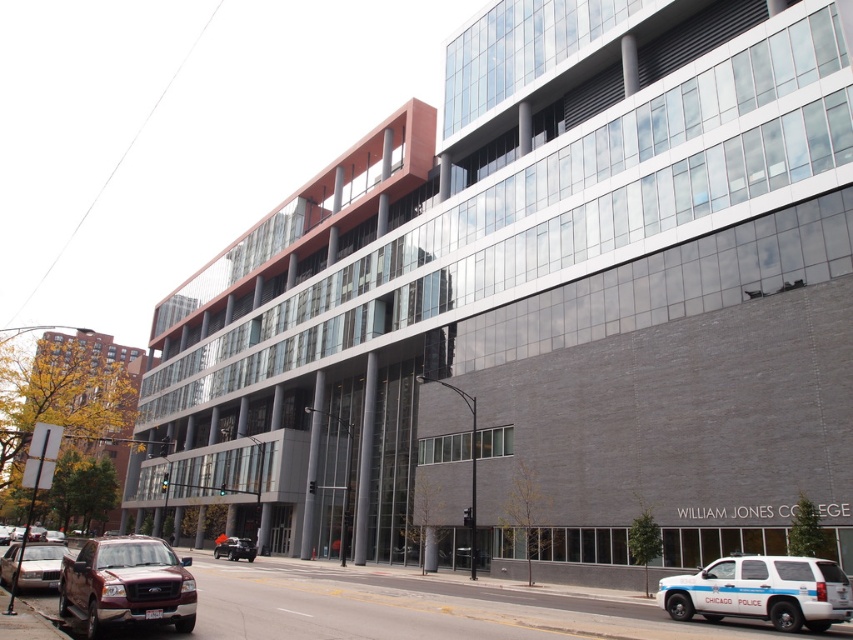
Question: Which point appears farthest from the camera in this image?

Choices:
 (A) (33, 561)
 (B) (251, 548)

Answer: (B)

Question: Can you confirm if white matte suv at lower right is smaller than gold metallic sedan at lower left?

Choices:
 (A) yes
 (B) no

Answer: (A)

Question: Can you confirm if white matte suv at lower right is wider than metallic silver car at center?

Choices:
 (A) no
 (B) yes

Answer: (B)

Question: In this image, where is matte red truck at lower left located relative to metallic silver car at center?

Choices:
 (A) right
 (B) left

Answer: (A)

Question: Among these objects, which one is nearest to the camera?

Choices:
 (A) matte red truck at lower left
 (B) metallic silver car at center
 (C) gold metallic sedan at lower left

Answer: (A)

Question: Which point appears farthest from the camera in this image?

Choices:
 (A) (247, 552)
 (B) (7, 552)

Answer: (A)